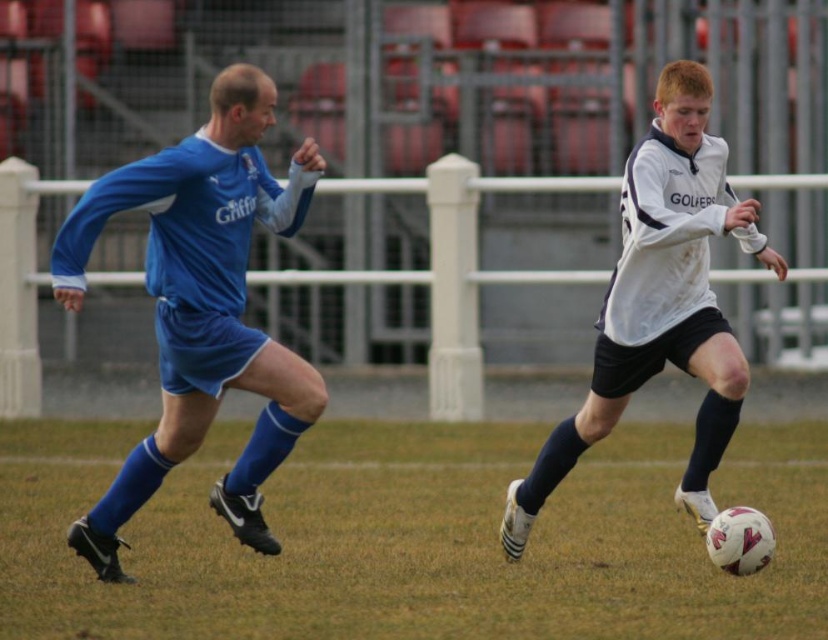
Question: Can you confirm if green grass at center is positioned to the right of white matte soccer ball at center?

Choices:
 (A) no
 (B) yes

Answer: (B)

Question: In this image, where is green grass at center located relative to matte blue jersey at left?

Choices:
 (A) above
 (B) below

Answer: (B)

Question: Which of these objects is positioned closest to the white matte soccer ball at center?

Choices:
 (A) green grass at center
 (B) matte blue jersey at left

Answer: (B)

Question: Based on their relative distances, which object is nearer to the white matte soccer ball at center?

Choices:
 (A) green grass at center
 (B) matte blue jersey at left

Answer: (B)

Question: Which object appears farthest from the camera in this image?

Choices:
 (A) green grass at center
 (B) white matte soccer ball at center

Answer: (A)

Question: From the image, what is the correct spatial relationship of green grass at center in relation to matte blue jersey at left?

Choices:
 (A) right
 (B) left

Answer: (A)